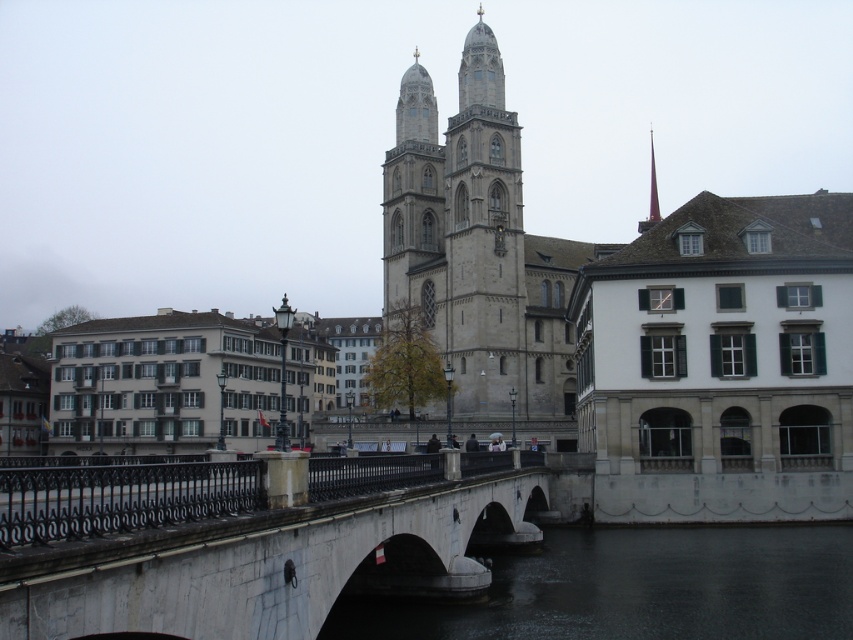
You are a drone operator who needs to capture aerial footage of the Grossmuenster Church. Your drone has a maximum flight range of 30 meters. You are currently positioned at the dark gray concrete waterway at lower center. Can your drone reach the Grossmuenster Church from your current position without exceeding its flight range?

The distance between the dark gray concrete waterway at lower center and the camera is 34.35 meters. Since the drone has a maximum flight range of 30 meters, it cannot reach the Grossmuenster Church without exceeding its limit.

Based on the photo, you are a tourist standing on the stone bridge and want to take a photo of the gray stone tower at center. The dark gray concrete waterway at lower center is blocking your view. Can you move to the right side of the bridge to get a clearer shot of the tower?

The dark gray concrete waterway at lower center is smaller than the gray stone tower at center. Moving to the right side of the bridge might allow you to position yourself so that the smaller waterway doesn